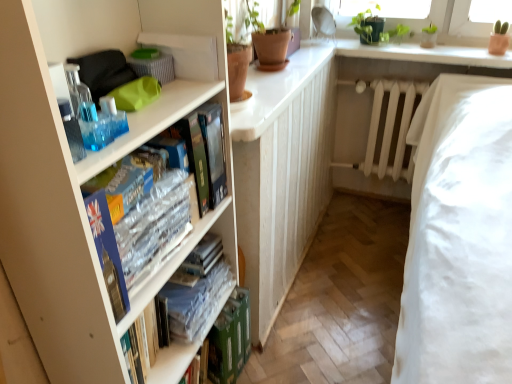
Question: From a real-world perspective, does clear plastic book at center, placed as the 2th book when sorted from bottom to top, sit lower than clear plastic books at center left, marked as the 3th book in a back-to-front arrangement?

Choices:
 (A) no
 (B) yes

Answer: (B)

Question: From the image's perspective, would you say clear plastic book at center, placed as the 2th book when sorted from bottom to top, is positioned over clear plastic books at center left, which is the 1th book in front-to-back order?

Choices:
 (A) no
 (B) yes

Answer: (A)

Question: Can we say clear plastic book at center, placed as the 2th book when sorted from bottom to top, lies outside clear plastic books at center left, acting as the 3th book starting from the bottom?

Choices:
 (A) yes
 (B) no

Answer: (A)

Question: Considering the relative positions of clear plastic book at center, which is counted as the second book, starting from the back, and clear plastic books at center left, marked as the 3th book in a back-to-front arrangement, in the image provided, is clear plastic book at center, which is counted as the second book, starting from the back, behind clear plastic books at center left, marked as the 3th book in a back-to-front arrangement,?

Choices:
 (A) no
 (B) yes

Answer: (B)

Question: Is clear plastic book at center, placed as the 2th book when sorted from bottom to top, wider than clear plastic books at center left, marked as the 3th book in a back-to-front arrangement?

Choices:
 (A) yes
 (B) no

Answer: (A)

Question: Does point click(x=378, y=82) appear closer or farther from the camera than point click(x=224, y=362)?

Choices:
 (A) closer
 (B) farther

Answer: (B)

Question: From their relative heights in the image, would you say white matte radiator at center is taller or shorter than green cardboard box at lower center, which appears as the 1th book when viewed from the back?

Choices:
 (A) tall
 (B) short

Answer: (A)

Question: Would you say white matte radiator at center is to the left or to the right of green cardboard box at lower center, which is the 3th book from front to back, in the picture?

Choices:
 (A) right
 (B) left

Answer: (A)

Question: In the image, is white matte radiator at center positioned in front of or behind green cardboard box at lower center, which is the 3th book from front to back?

Choices:
 (A) behind
 (B) front

Answer: (A)

Question: From a real-world perspective, is green matte plant at upper right positioned above or below green cardboard box at lower center, which appears as the 1th book when viewed from the back?

Choices:
 (A) above
 (B) below

Answer: (A)

Question: From their relative heights in the image, would you say green matte plant at upper right is taller or shorter than green cardboard box at lower center, which is the 3th book from front to back?

Choices:
 (A) tall
 (B) short

Answer: (B)

Question: Is green matte plant at upper right inside the boundaries of green cardboard box at lower center, which appears as the 1th book when viewed from the back, or outside?

Choices:
 (A) inside
 (B) outside

Answer: (B)

Question: In the image, is green matte plant at upper right positioned in front of or behind green cardboard box at lower center, which appears as the 1th book when viewed from the back?

Choices:
 (A) front
 (B) behind

Answer: (B)

Question: Is white matte radiator at center wider or thinner than clear plastic book at center, which is counted as the second book, starting from the back?

Choices:
 (A) thin
 (B) wide

Answer: (A)

Question: From a real-world perspective, is white matte radiator at center positioned above or below clear plastic book at center, which is counted as the 2th book, starting from the top?

Choices:
 (A) above
 (B) below

Answer: (A)